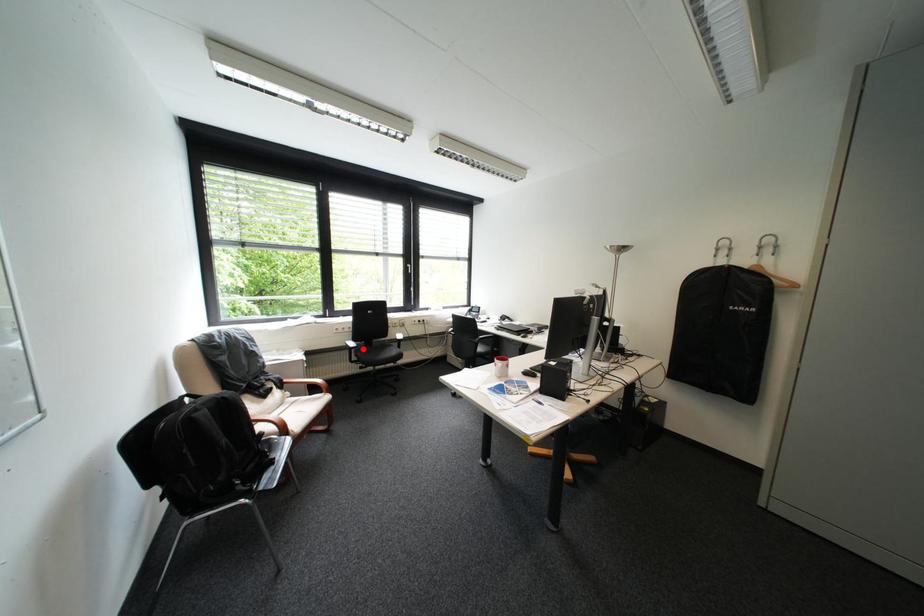
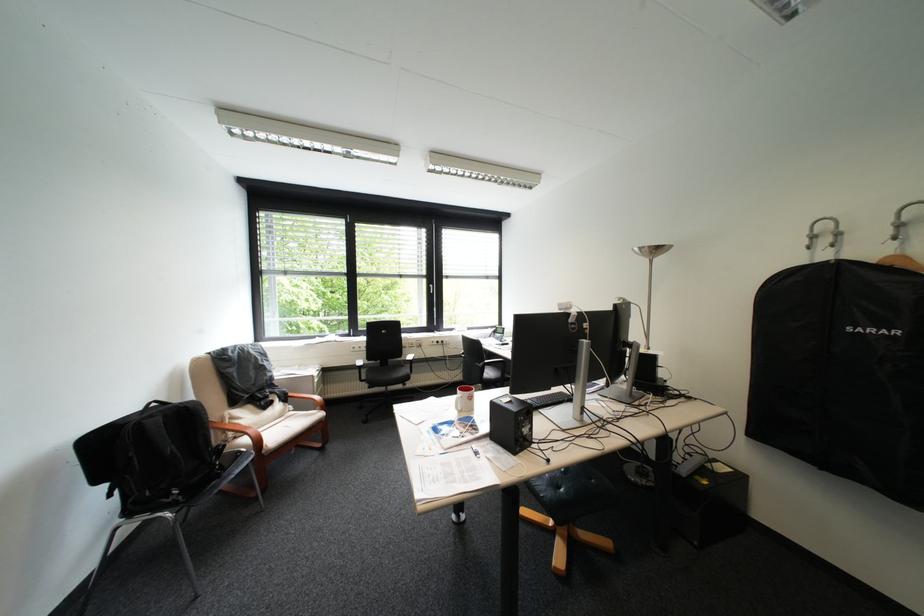
Locate, in the second image, the point that corresponds to the highlighted location in the first image.

(371, 368)